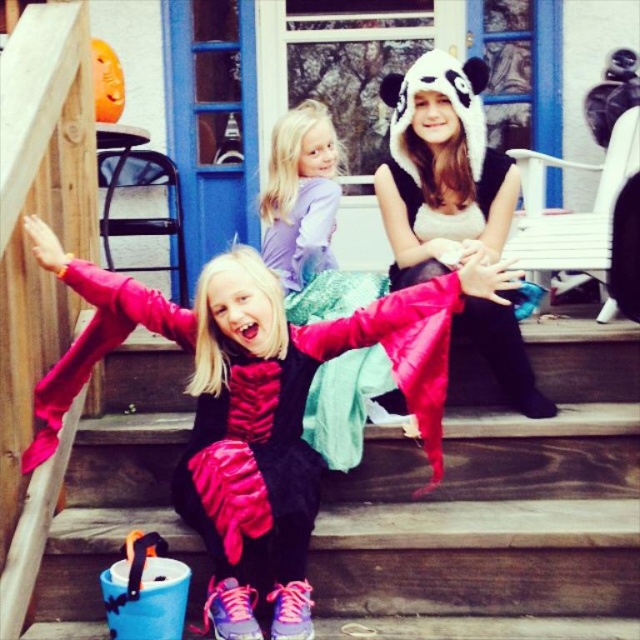
You are a parent trying to ensure your child can reach the purple satin dress at center from the wooden stairs at lower center. The child is 32 inches tall. Can they comfortably reach the dress without needing a stool?

The wooden stairs at lower center is 28.55 inches away from purple satin dress at center. Since the child is 32 inches tall, they can comfortably reach the dress without needing a stool because the distance is within their reach.

You are a parent trying to carry a Halloween costume box that is 1.2 meters tall. You need to place it on the wooden stairs at lower center and the purple satin dress at center. Which location can you place the box without it exceeding the height?

The wooden stairs at lower center is much taller than the purple satin dress at center, so you can place the box on the wooden stairs at lower center without exceeding its height since the stairs are taller than the box.